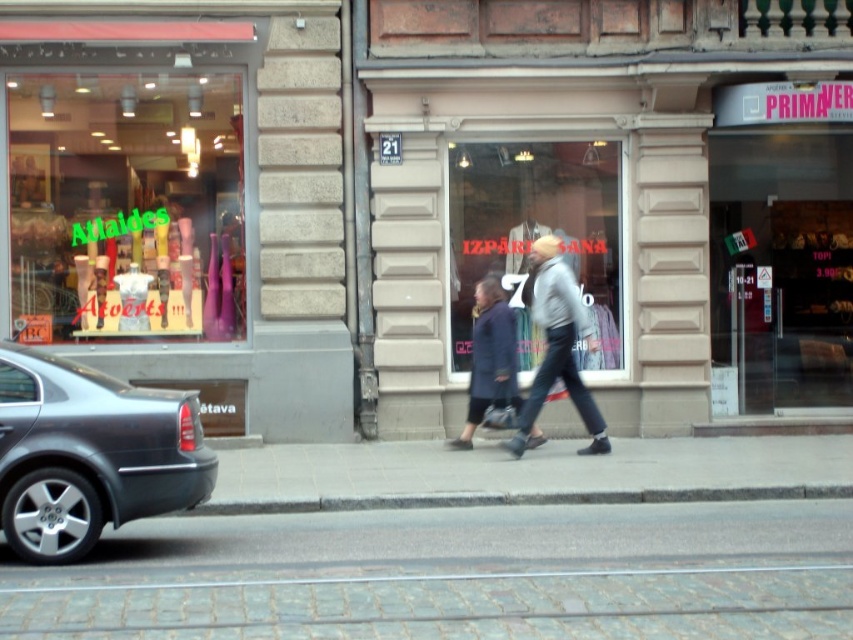
You are a tourist standing on the cobblestone pavement at lower center and you see the dark blue coat at center. Which object is closer to the ground?

The cobblestone pavement at lower center is positioned under the dark blue coat at center, so the cobblestone pavement at lower center is closer to the ground.

You are a delivery person trying to place a package on the transparent glass display at center and the gray knit sweater at center. Which object has a larger width to accommodate the package?

The transparent glass display at center has a larger width than the gray knit sweater at center, so it can accommodate the package better.